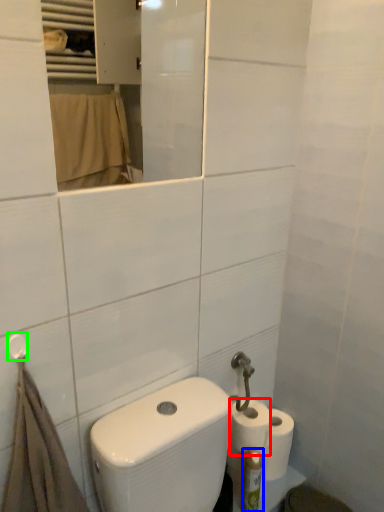
Question: Which is nearer to the toilet paper (highlighted by a red box)? toiletry (highlighted by a blue box) or towel bar (highlighted by a green box).

Choices:
 (A) toiletry
 (B) towel bar

Answer: (A)